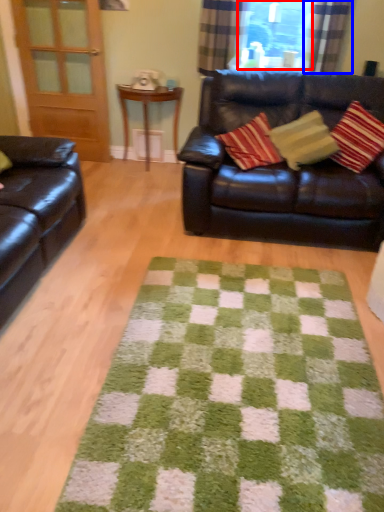
Question: Which object appears closest to the camera in this image, window screen (highlighted by a red box) or curtain (highlighted by a blue box)?

Choices:
 (A) window screen
 (B) curtain

Answer: (B)